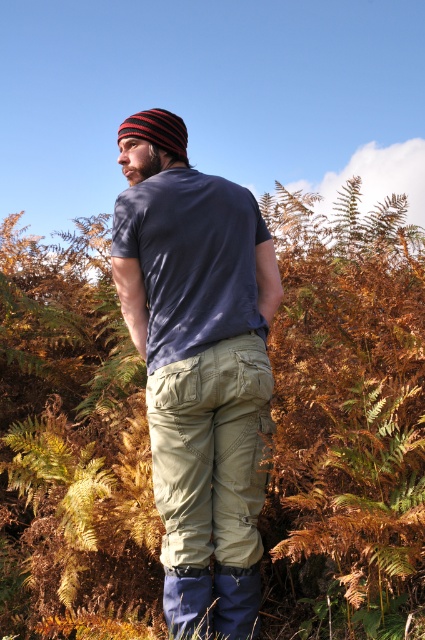
Who is positioned more to the left, brown dry leaves at center or matte blue t-shirt at center?

From the viewer's perspective, brown dry leaves at center appears more on the left side.

Based on the photo, does brown dry leaves at center have a larger size compared to matte blue t-shirt at center?

Yes.

The width and height of the screenshot is (425, 640). I want to click on brown dry leaves at center, so point(345,422).

Find the location of `brown dry leaves at center`. brown dry leaves at center is located at coordinates 345,422.